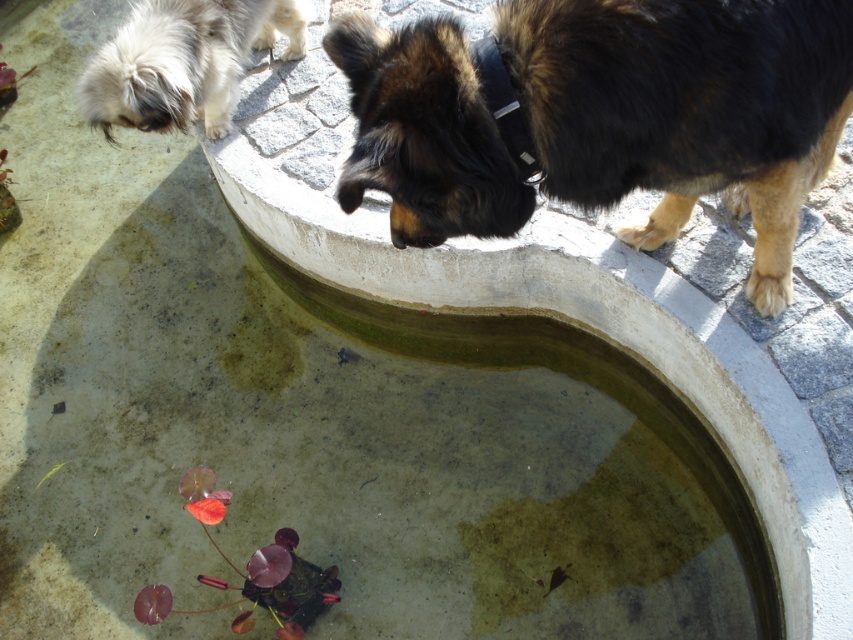
Who is more distant from viewer, (395, 112) or (97, 99)?

The point (97, 99) is more distant.

Consider the image. Who is positioned more to the left, dark brown fur at upper right or white fluffy dog at upper left?

From the viewer's perspective, white fluffy dog at upper left appears more on the left side.

Which is behind, point (770, 252) or point (161, 33)?

Point (161, 33)

Identify the location of dark brown fur at upper right. (685, 108).